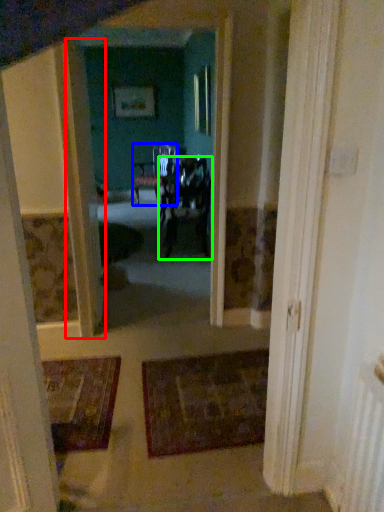
Question: Which object is the farthest from door (highlighted by a red box)? Choose among these: chair (highlighted by a blue box) or chair (highlighted by a green box).

Choices:
 (A) chair
 (B) chair

Answer: (A)